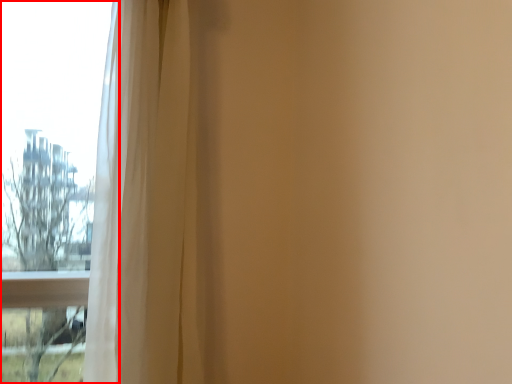
Question: From the image's perspective, what is the correct spatial positioning of window (annotated by the red box) in reference to curtain?

Choices:
 (A) above
 (B) below

Answer: (A)